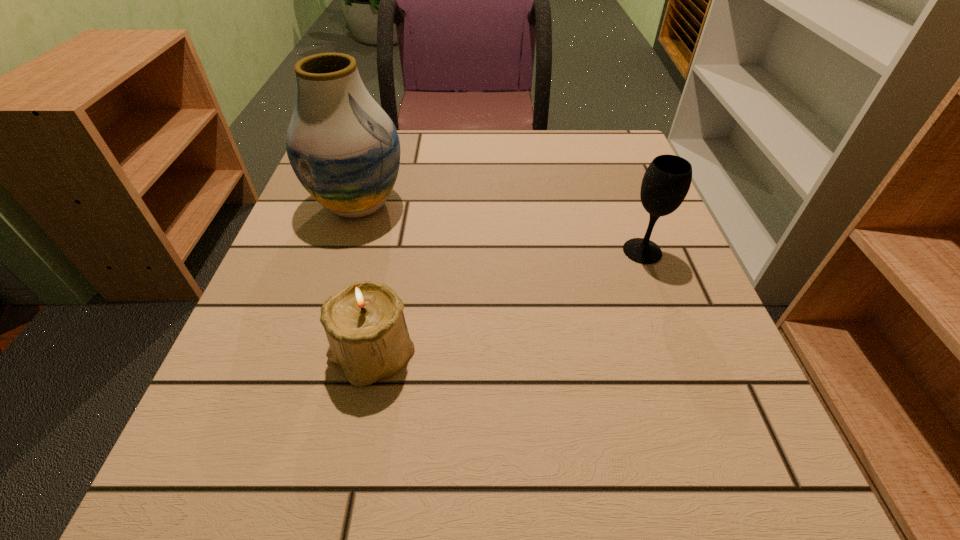
Identify the location of vase located at the left edge. (x=344, y=149).

Where is `candle_holder present at the left edge`? This screenshot has height=540, width=960. candle_holder present at the left edge is located at coordinates (364, 322).

Find the location of `object situated at the right edge`. object situated at the right edge is located at coordinates (666, 182).

The height and width of the screenshot is (540, 960). What are the coordinates of `object positioned at the far left corner` in the screenshot? It's located at (344, 149).

Image resolution: width=960 pixels, height=540 pixels. I want to click on free spot at the far edge of the desktop, so click(469, 158).

This screenshot has height=540, width=960. I want to click on vacant space at the near edge of the desktop, so click(633, 482).

Locate an element on the screen. This screenshot has width=960, height=540. vacant point at the left edge is located at coordinates (319, 226).

The height and width of the screenshot is (540, 960). What are the coordinates of `vacant space at the right edge` in the screenshot? It's located at (655, 240).

Identify the location of free spot at the far right corner of the desktop. (628, 173).

In the image, there is a desktop. Where is `vacant space at the near right corner`? This screenshot has width=960, height=540. vacant space at the near right corner is located at coordinates (748, 500).